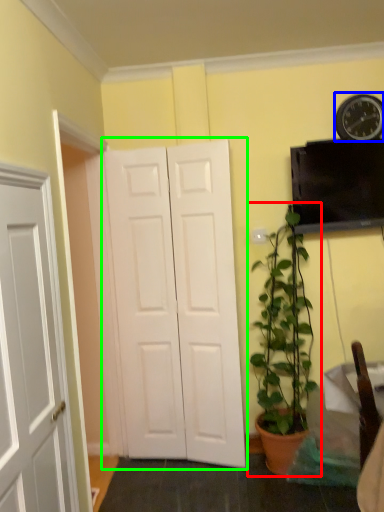
Question: Based on their relative distances, which object is nearer to houseplant (highlighted by a red box)? Choose from clock (highlighted by a blue box) and door (highlighted by a green box).

Choices:
 (A) clock
 (B) door

Answer: (B)